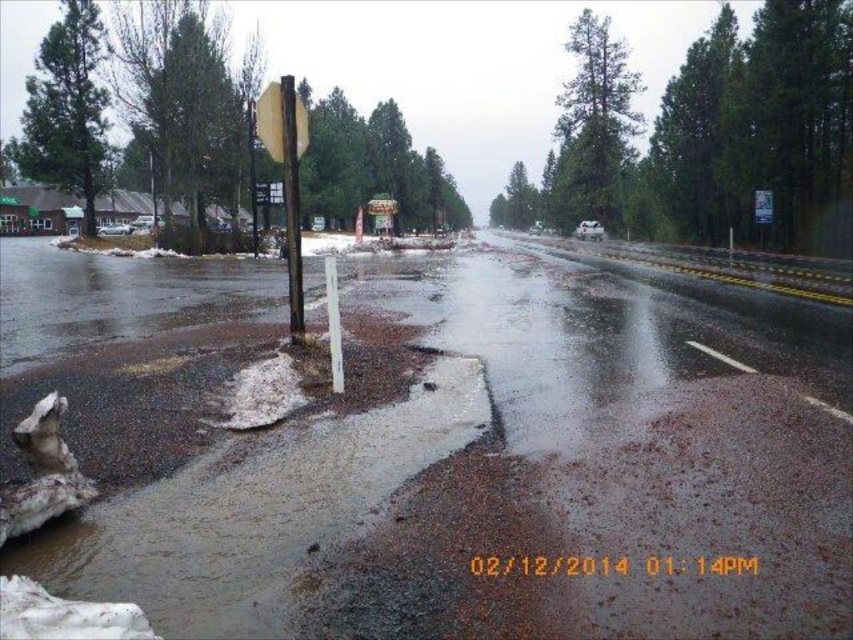
Question: Does brown mud at lower left appear over yellow matte stop sign at upper center?

Choices:
 (A) yes
 (B) no

Answer: (B)

Question: Estimate the real-world distances between objects in this image. Which object is closer to the brown mud at lower left?

Choices:
 (A) yellow matte stop sign at upper center
 (B) metallic pole at center

Answer: (B)

Question: Is metallic pole at center further to camera compared to yellow matte stop sign at upper center?

Choices:
 (A) yes
 (B) no

Answer: (B)

Question: Among these objects, which one is nearest to the camera?

Choices:
 (A) yellow matte stop sign at upper center
 (B) metallic pole at center

Answer: (B)

Question: Which of the following is the closest to the observer?

Choices:
 (A) (267, 193)
 (B) (527, 413)
 (C) (286, 259)

Answer: (B)

Question: Can you confirm if brown mud at lower left is smaller than yellow matte stop sign at upper center?

Choices:
 (A) no
 (B) yes

Answer: (A)